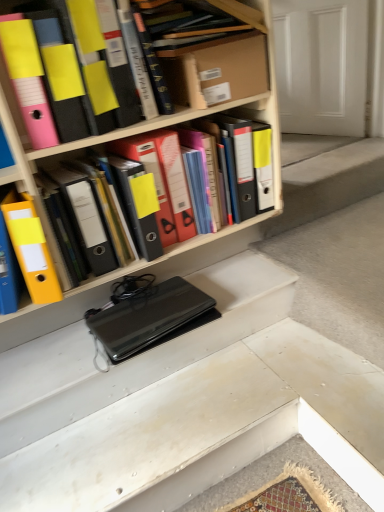
Question: Would you say white matte door at upper right contains cardboard box at upper center?

Choices:
 (A) no
 (B) yes

Answer: (A)

Question: Is white matte door at upper right looking in the opposite direction of cardboard box at upper center?

Choices:
 (A) no
 (B) yes

Answer: (A)

Question: From the image's perspective, does white matte door at upper right appear higher than cardboard box at upper center?

Choices:
 (A) no
 (B) yes

Answer: (B)

Question: From a real-world perspective, is white matte door at upper right on cardboard box at upper center?

Choices:
 (A) no
 (B) yes

Answer: (A)

Question: Considering the relative sizes of white matte door at upper right and cardboard box at upper center in the image provided, is white matte door at upper right thinner than cardboard box at upper center?

Choices:
 (A) no
 (B) yes

Answer: (B)

Question: Looking at their shapes, would you say white matte door at upper right is wider or thinner than matte black binder at upper left, arranged as the first book when viewed from the left?

Choices:
 (A) wide
 (B) thin

Answer: (B)

Question: In terms of size, does white matte door at upper right appear bigger or smaller than matte black binder at upper left, which is the 3th book from right to left?

Choices:
 (A) big
 (B) small

Answer: (B)

Question: Is white matte door at upper right taller or shorter than matte black binder at upper left, arranged as the first book when viewed from the left?

Choices:
 (A) short
 (B) tall

Answer: (B)

Question: Does point (349, 8) appear closer or farther from the camera than point (188, 91)?

Choices:
 (A) farther
 (B) closer

Answer: (A)

Question: In terms of height, does wooden book at upper center, the third book positioned from the left, look taller or shorter compared to cardboard box at upper center?

Choices:
 (A) short
 (B) tall

Answer: (B)

Question: Visually, is wooden book at upper center, which appears as the 1th book when viewed from the right, positioned to the left or to the right of cardboard box at upper center?

Choices:
 (A) left
 (B) right

Answer: (B)

Question: Is wooden book at upper center, which appears as the 1th book when viewed from the right, spatially inside cardboard box at upper center, or outside of it?

Choices:
 (A) outside
 (B) inside

Answer: (A)

Question: In the image, is wooden book at upper center, the third book positioned from the left, positioned in front of or behind cardboard box at upper center?

Choices:
 (A) behind
 (B) front

Answer: (B)

Question: Choose the correct answer: Is yellow matte ring binder at center inside hardcover book at upper center, which is the second book from left to right, or outside it?

Choices:
 (A) inside
 (B) outside

Answer: (B)

Question: Looking at the image, does yellow matte ring binder at center seem bigger or smaller compared to hardcover book at upper center, the 2th book viewed from the right?

Choices:
 (A) big
 (B) small

Answer: (A)